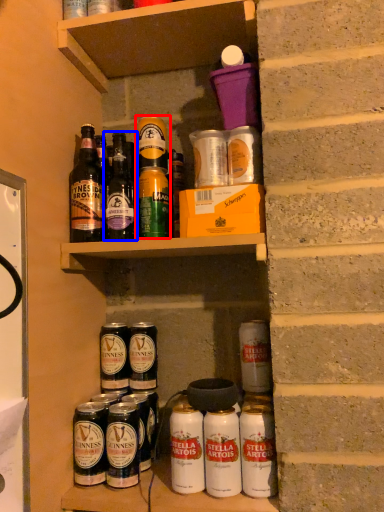
Question: Which of the following is the farthest to the observer, yoghurt (highlighted by a red box) or bottle (highlighted by a blue box)?

Choices:
 (A) yoghurt
 (B) bottle

Answer: (A)